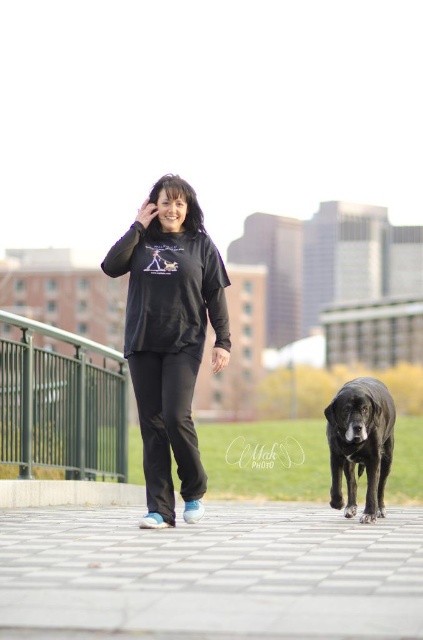
Is paved stone pavement at lower center to the right of shiny black fur at center from the viewer's perspective?

In fact, paved stone pavement at lower center is to the left of shiny black fur at center.

Based on the photo, which of these two, paved stone pavement at lower center or shiny black fur at center, stands shorter?

shiny black fur at center is shorter.

Which is behind, point (335, 544) or point (340, 442)?

The point (340, 442) is behind.

At what (x,y) coordinates should I click in order to perform the action: click on paved stone pavement at lower center. Please return your answer as a coordinate pair (x, y). This screenshot has width=423, height=640. Looking at the image, I should click on click(211, 573).

Can you confirm if paved stone pavement at lower center is positioned below matte black hoodie at center?

Yes, paved stone pavement at lower center is below matte black hoodie at center.

The image size is (423, 640). What do you see at coordinates (211, 573) in the screenshot?
I see `paved stone pavement at lower center` at bounding box center [211, 573].

At what (x,y) coordinates should I click in order to perform the action: click on paved stone pavement at lower center. Please return your answer as a coordinate pair (x, y). Looking at the image, I should click on (211, 573).

In the scene shown: Which is above, paved stone pavement at lower center or black matte sweatshirt at center?

Positioned higher is black matte sweatshirt at center.

Locate an element on the screen. The height and width of the screenshot is (640, 423). paved stone pavement at lower center is located at coordinates (211, 573).

This screenshot has height=640, width=423. Identify the location of paved stone pavement at lower center. (211, 573).

Locate an element on the screen. The width and height of the screenshot is (423, 640). paved stone pavement at lower center is located at coordinates (211, 573).